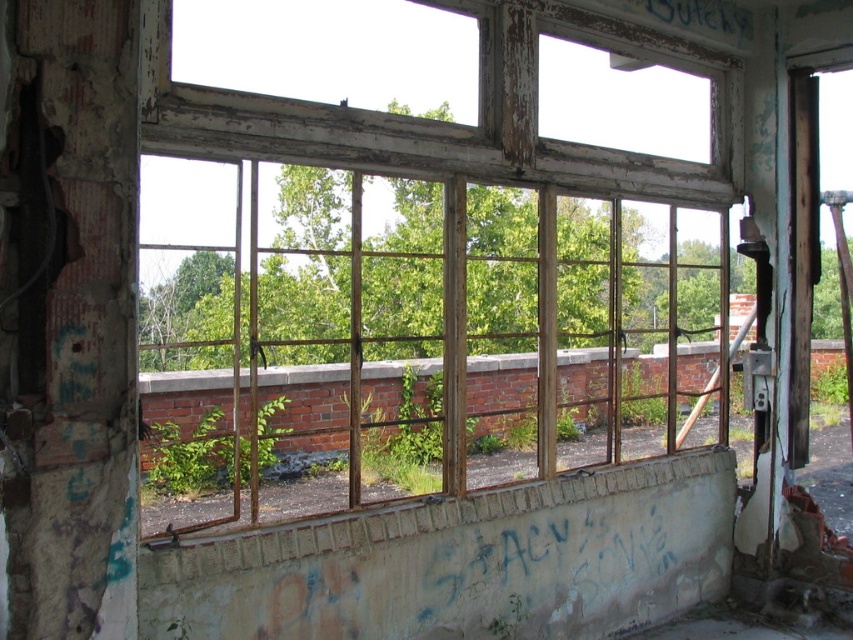
Can you confirm if weathered wood window frame at center is positioned above green leafy plant at center?

Indeed, weathered wood window frame at center is positioned over green leafy plant at center.

Which is more to the right, weathered wood window frame at center or green leafy plant at center?

weathered wood window frame at center

Who is more distant from viewer, (x=196, y=212) or (x=198, y=472)?

Positioned behind is point (x=198, y=472).

Find the location of `weathered wood window frame at center`. weathered wood window frame at center is located at coordinates (434, 252).